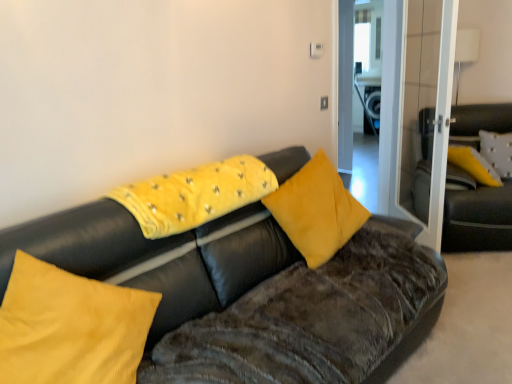
Question: Looking at the image, does yellow fabric pillow at upper right, acting as the 4th pillow starting from the left, seem bigger or smaller compared to velvet yellow pillow at center, the first pillow viewed from the left?

Choices:
 (A) big
 (B) small

Answer: (B)

Question: In the image, is yellow fabric pillow at upper right, acting as the 4th pillow starting from the left, on the left side or the right side of velvet yellow pillow at center, which is the 4th pillow from right to left?

Choices:
 (A) left
 (B) right

Answer: (B)

Question: Which of these objects is positioned closest to the velvet black couch at right, which ranks as the 1th studio couch in back-to-front order?

Choices:
 (A) velvet yellow pillow at center, arranged as the 4th pillow when viewed from the back
 (B) transparent glass door at right
 (C) velvet black couch at center, positioned as the second studio couch in back-to-front order
 (D) yellow fabric pillow at upper right, which ranks as the first pillow in right-to-left order
 (E) yellow velvet pillow at center, acting as the 2th pillow starting from the left

Answer: (D)

Question: Which object is the closest to the velvet black couch at center, the first studio couch positioned from the front?

Choices:
 (A) yellow fabric pillow at upper right, which ranks as the first pillow in right-to-left order
 (B) transparent glass door at right
 (C) velvet yellow pillow at center, placed as the third pillow when sorted from front to back
 (D) yellow velvet pillow at center, acting as the 3th pillow starting from the right
 (E) velvet black couch at right, the second studio couch from the left

Answer: (D)